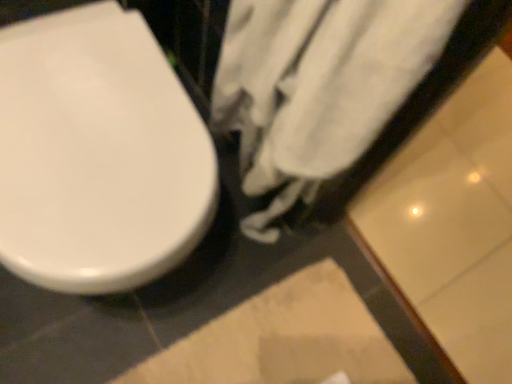
You are a GUI agent. You are given a task and a screenshot of the screen. Output one action in this format:
    pyautogui.click(x=<x>, y=<y>)
    Task: Click on the white glossy toilet seat at left
    This screenshot has width=512, height=384.
    Given the screenshot: What is the action you would take?
    pyautogui.click(x=98, y=154)

This screenshot has height=384, width=512. What are the coordinates of `beige textured rug at lower center` in the screenshot? It's located at (283, 339).

You are a GUI agent. You are given a task and a screenshot of the screen. Output one action in this format:
    pyautogui.click(x=<x>, y=<y>)
    Task: Click on the white glossy toilet seat at left
    
    Given the screenshot: What is the action you would take?
    pyautogui.click(x=98, y=154)

Is there a large distance between beige textured rug at lower center and white cotton towel at center?

No, beige textured rug at lower center is not far away from white cotton towel at center.

How many degrees apart are the facing directions of beige textured rug at lower center and white cotton towel at center?

They differ by 172 degrees in their facing directions.

Which object is closer to the camera, beige textured rug at lower center or white cotton towel at center?

white cotton towel at center is in front.

Is point (195, 376) in front of point (394, 37)?

No.

Image resolution: width=512 pixels, height=384 pixels. What are the coordinates of `square located on the right of white glossy toilet seat at left` in the screenshot? It's located at (283, 339).

Is point (295, 314) positioned after point (183, 175)?

Yes, it is.

Between beige textured rug at lower center and white glossy toilet seat at left, which one has more height?

white glossy toilet seat at left is taller.

Is white glossy toilet seat at left aimed at beige textured rug at lower center?

Yes, white glossy toilet seat at left faces towards beige textured rug at lower center.

How many degrees apart are the facing directions of white glossy toilet seat at left and beige textured rug at lower center?

The angle between the facing direction of white glossy toilet seat at left and the facing direction of beige textured rug at lower center is 87.1 degrees.

Is white glossy toilet seat at left at the left side of beige textured rug at lower center?

Yes.

Who is smaller, white glossy toilet seat at left or white cotton towel at center?

white cotton towel at center.

Is white glossy toilet seat at left next to white cotton towel at center?

No, white glossy toilet seat at left is not beside white cotton towel at center.

In the scene shown: How different are the orientations of white glossy toilet seat at left and white cotton towel at center in degrees?

85.3 degrees separate the facing orientations of white glossy toilet seat at left and white cotton towel at center.

Does white glossy toilet seat at left have a greater width compared to white cotton towel at center?

Yes.

Locate an element on the screen. Image resolution: width=512 pixels, height=384 pixels. square on the left of the white cotton towel at center is located at coordinates (283, 339).

Which is behind, point (417, 57) or point (368, 378)?

The point (368, 378) is farther from the camera.

Is white cotton towel at center surrounding beige textured rug at lower center?

That's incorrect, beige textured rug at lower center is not inside white cotton towel at center.

Who is taller, white cotton towel at center or beige textured rug at lower center?

white cotton towel at center is taller.

Which object is closer to the camera, white cotton towel at center or white glossy toilet seat at left?

white cotton towel at center is in front.

Is white cotton towel at center aimed at white glossy toilet seat at left?

Yes, white cotton towel at center is aimed at white glossy toilet seat at left.

Which of these two, white cotton towel at center or white glossy toilet seat at left, stands shorter?

white glossy toilet seat at left.

Locate an element on the screen. The width and height of the screenshot is (512, 384). toilet lying on the left of white cotton towel at center is located at coordinates click(x=98, y=154).

This screenshot has height=384, width=512. I want to click on square located below the white cotton towel at center (from the image's perspective), so click(283, 339).

Identify the location of square on the right of white glossy toilet seat at left. The width and height of the screenshot is (512, 384). (283, 339).

Looking at the image, which one is located closer to white glossy toilet seat at left, white cotton towel at center or beige textured rug at lower center?

The object closer to white glossy toilet seat at left is white cotton towel at center.

Looking at the image, which one is located further to white cotton towel at center, beige textured rug at lower center or white glossy toilet seat at left?

beige textured rug at lower center is further to white cotton towel at center.

Looking at the image, which one is located further to beige textured rug at lower center, white glossy toilet seat at left or white cotton towel at center?

white glossy toilet seat at left lies further to beige textured rug at lower center than the other object.

Based on the photo, from the image, which object appears to be nearer to white cotton towel at center, white glossy toilet seat at left or beige textured rug at lower center?

white glossy toilet seat at left.

Looking at the image, which one is located further to white glossy toilet seat at left, beige textured rug at lower center or white cotton towel at center?

beige textured rug at lower center is positioned further to the anchor white glossy toilet seat at left.

When comparing their distances from beige textured rug at lower center, does white cotton towel at center or white glossy toilet seat at left seem closer?

The object closer to beige textured rug at lower center is white cotton towel at center.

Where is `toilet between white cotton towel at center and beige textured rug at lower center from top to bottom`? toilet between white cotton towel at center and beige textured rug at lower center from top to bottom is located at coordinates (98, 154).